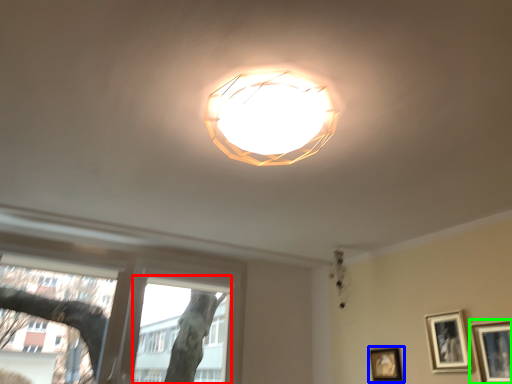
Question: Considering the real-world distances, which object is closest to bay window (highlighted by a red box)? picture frame (highlighted by a blue box) or picture frame (highlighted by a green box).

Choices:
 (A) picture frame
 (B) picture frame

Answer: (A)